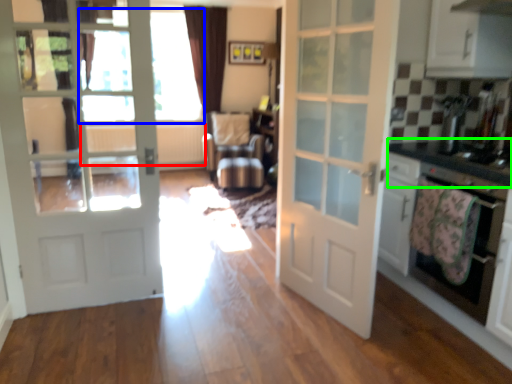
Question: Considering the real-world distances, which object is farthest from radiator (highlighted by a red box)? window screen (highlighted by a blue box) or counter top (highlighted by a green box)?

Choices:
 (A) window screen
 (B) counter top

Answer: (B)